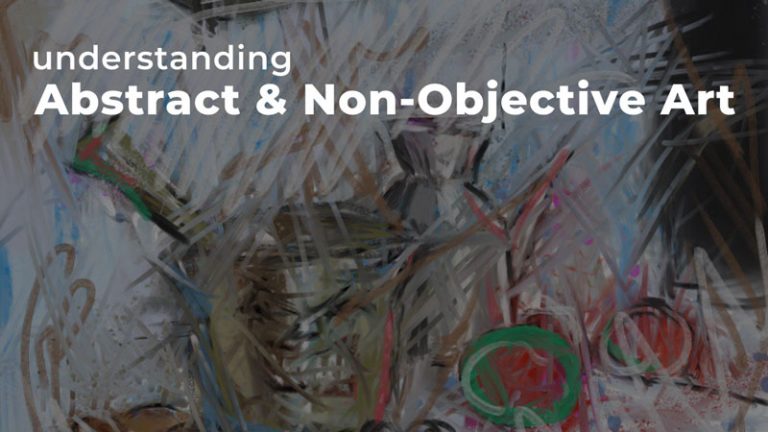
Where is `art`? The image size is (768, 432). art is located at coordinates (697, 98).